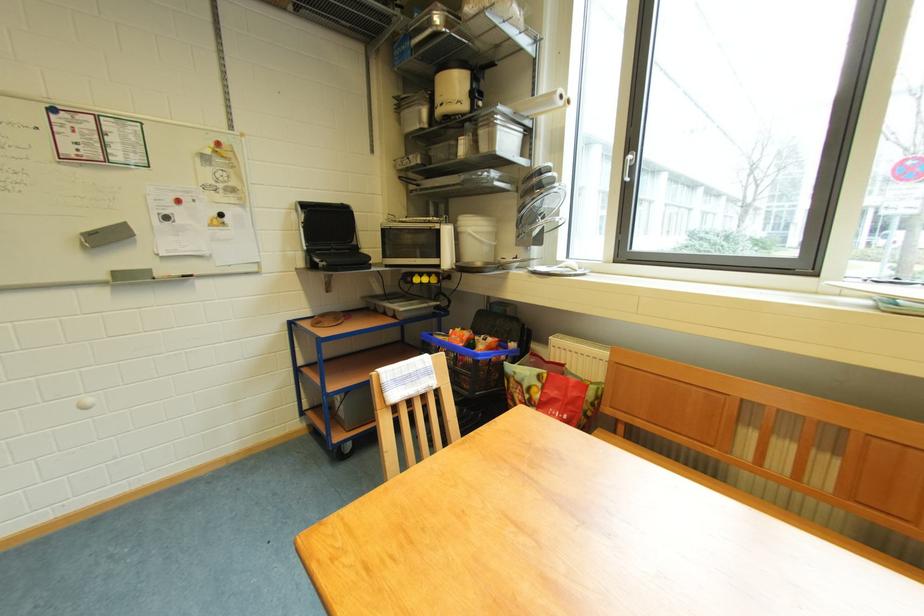
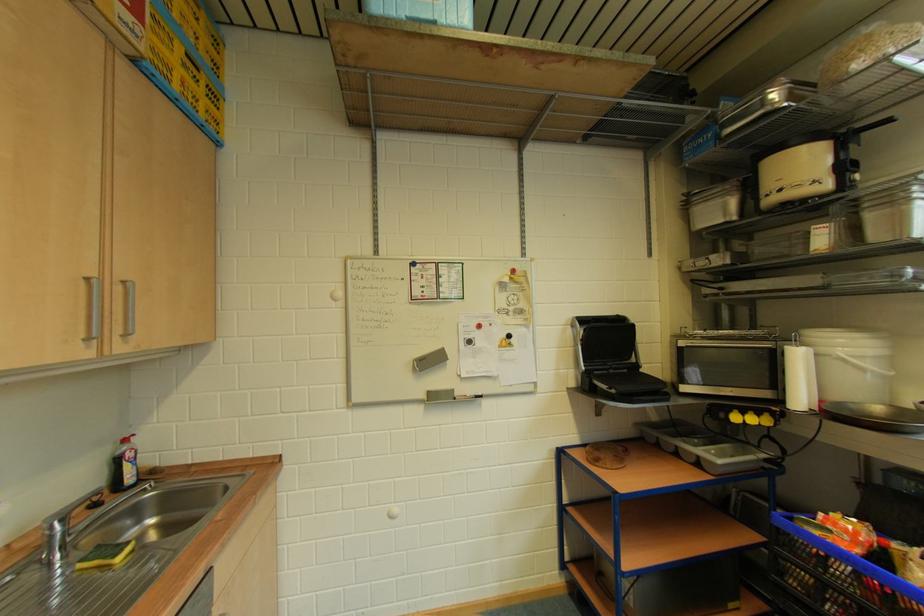
The point at (305, 214) is marked in the first image. Where is the corresponding point in the second image?

(579, 329)